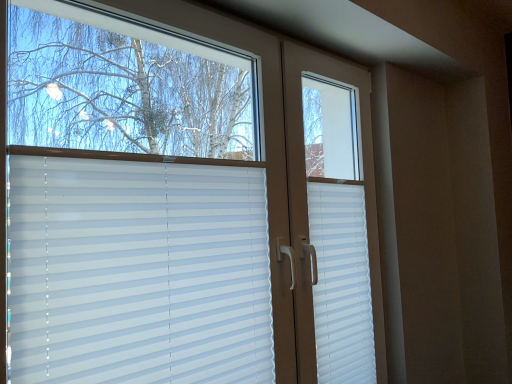
Where is `vacant region above white plastic blinds at center (from a real-world perspective)`? vacant region above white plastic blinds at center (from a real-world perspective) is located at coordinates (154, 163).